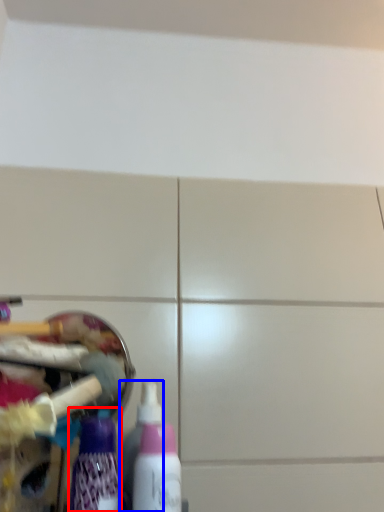
Question: Which point is closer to the camera, bottle (highlighted by a red box) or bottle (highlighted by a blue box)?

Choices:
 (A) bottle
 (B) bottle

Answer: (A)